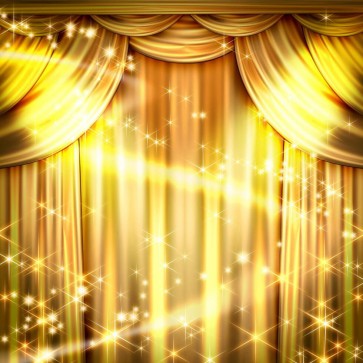
Locate an element on the screen. This screenshot has height=363, width=363. curtains is located at coordinates (318, 331), (42, 275), (159, 271).